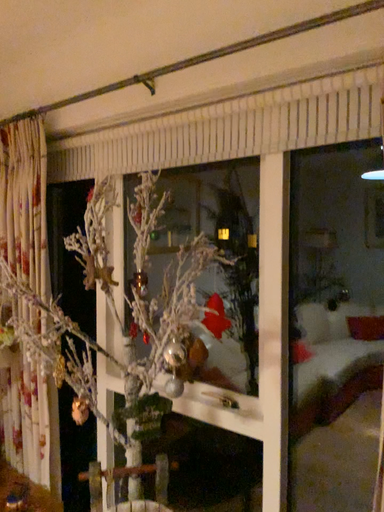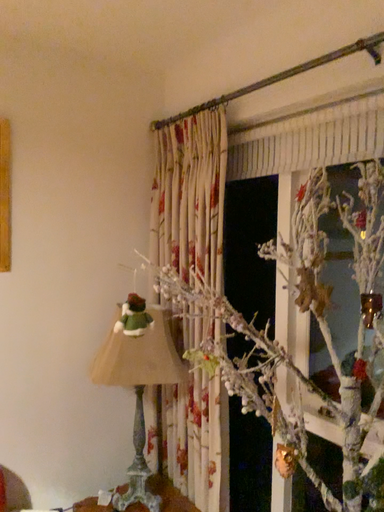
Question: Which way did the camera rotate in the video?

Choices:
 (A) rotated right
 (B) rotated left

Answer: (B)